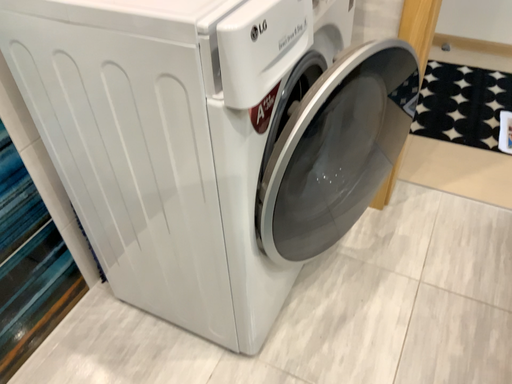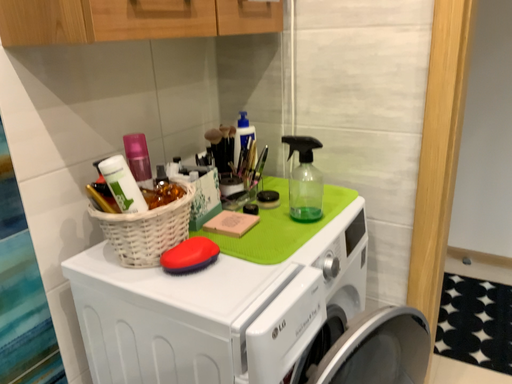
Question: Which way did the camera rotate in the video?

Choices:
 (A) rotated downward
 (B) rotated upward

Answer: (B)